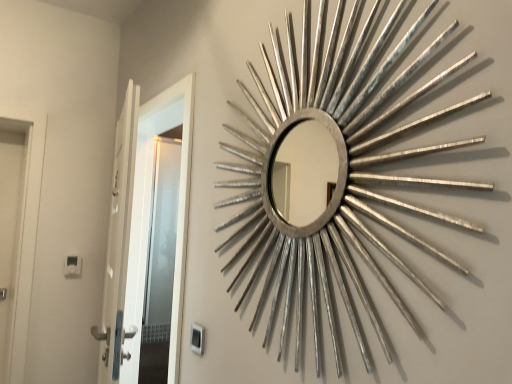
Question: Considering the positions of silver metallic sunburst mirror at upper right and white glossy door at left in the image, is silver metallic sunburst mirror at upper right wider or thinner than white glossy door at left?

Choices:
 (A) thin
 (B) wide

Answer: (A)

Question: From a real-world perspective, is silver metallic sunburst mirror at upper right positioned above or below white glossy door at left?

Choices:
 (A) above
 (B) below

Answer: (A)

Question: From the image's perspective, is silver metallic sunburst mirror at upper right above or below white glossy door at left?

Choices:
 (A) above
 (B) below

Answer: (A)

Question: Based on their positions, is white glossy door at left located to the left or right of silver metallic sunburst mirror at upper right?

Choices:
 (A) left
 (B) right

Answer: (A)

Question: Is white glossy door at left situated inside silver metallic sunburst mirror at upper right or outside?

Choices:
 (A) outside
 (B) inside

Answer: (A)

Question: Considering the positions of white glossy door at left and silver metallic sunburst mirror at upper right in the image, is white glossy door at left taller or shorter than silver metallic sunburst mirror at upper right?

Choices:
 (A) short
 (B) tall

Answer: (B)

Question: From the image's perspective, is white glossy door at left positioned above or below silver metallic sunburst mirror at upper right?

Choices:
 (A) below
 (B) above

Answer: (A)